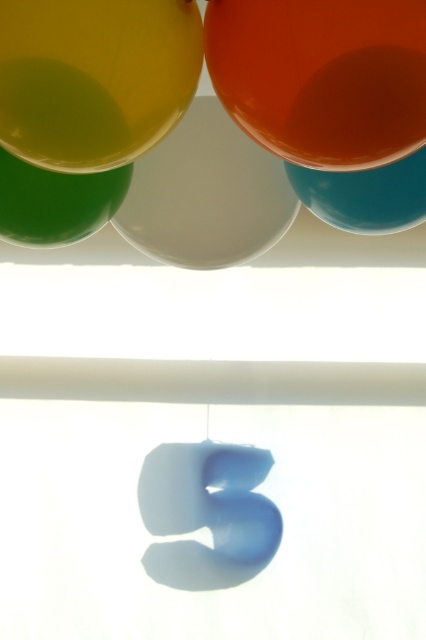
Question: Is translucent yellow balloon at upper left positioned before glossy white balloon at center?

Choices:
 (A) no
 (B) yes

Answer: (B)

Question: Which object appears closest to the camera in this image?

Choices:
 (A) translucent yellow balloon at upper left
 (B) glossy white balloon at center
 (C) green rubber balloon at left
 (D) translucent blue number at center

Answer: (A)

Question: Considering the relative positions of translucent blue number at center and teal glossy balloon at upper right in the image provided, where is translucent blue number at center located with respect to teal glossy balloon at upper right?

Choices:
 (A) left
 (B) right

Answer: (A)

Question: Can you confirm if translucent blue number at center is bigger than teal glossy balloon at upper right?

Choices:
 (A) no
 (B) yes

Answer: (B)

Question: Which object is closer to the camera taking this photo?

Choices:
 (A) translucent yellow balloon at upper left
 (B) glossy white balloon at center

Answer: (A)

Question: Which object is closer to the camera taking this photo?

Choices:
 (A) glossy white balloon at center
 (B) teal glossy balloon at upper right
 (C) glossy orange balloon at upper center

Answer: (C)